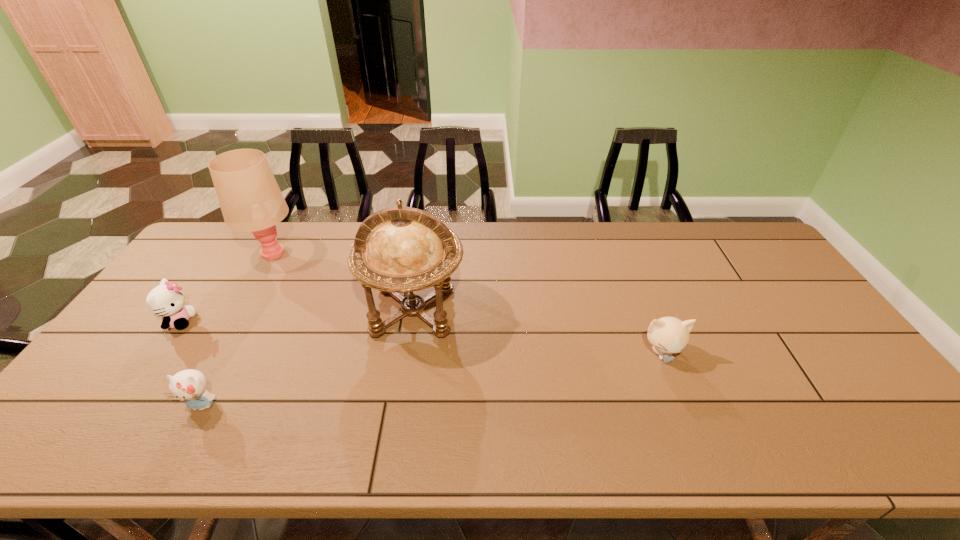
This screenshot has height=540, width=960. I want to click on empty space between the farthest object and the rightmost object, so click(x=467, y=303).

What are the coordinates of `vacant area between the second kitten from right to left and the lampshade` in the screenshot? It's located at (237, 329).

Where is `free point between the second object from right to left and the farthest object`? The image size is (960, 540). free point between the second object from right to left and the farthest object is located at coordinates (343, 282).

You are a GUI agent. You are given a task and a screenshot of the screen. Output one action in this format:
    pyautogui.click(x=<x>, y=<y>)
    Task: Click on the free space between the second object from right to left and the leftmost kitten
    
    Given the screenshot: What is the action you would take?
    pos(297,316)

This screenshot has height=540, width=960. What are the coordinates of `unoccupied position between the globe and the rightmost kitten` in the screenshot? It's located at (538, 332).

The image size is (960, 540). What are the coordinates of `free space between the farthest kitten and the second kitten from left to right` in the screenshot? It's located at (190, 363).

Where is `unoccupied position between the globe and the lampshade`? unoccupied position between the globe and the lampshade is located at coordinates (343, 282).

Where is `empty space between the leftmost object and the globe`? Image resolution: width=960 pixels, height=540 pixels. empty space between the leftmost object and the globe is located at coordinates (297, 316).

Image resolution: width=960 pixels, height=540 pixels. I want to click on free space that is in between the rightmost kitten and the second kitten from right to left, so click(432, 379).

I want to click on object that stands as the third closest to the rightmost kitten, so click(250, 199).